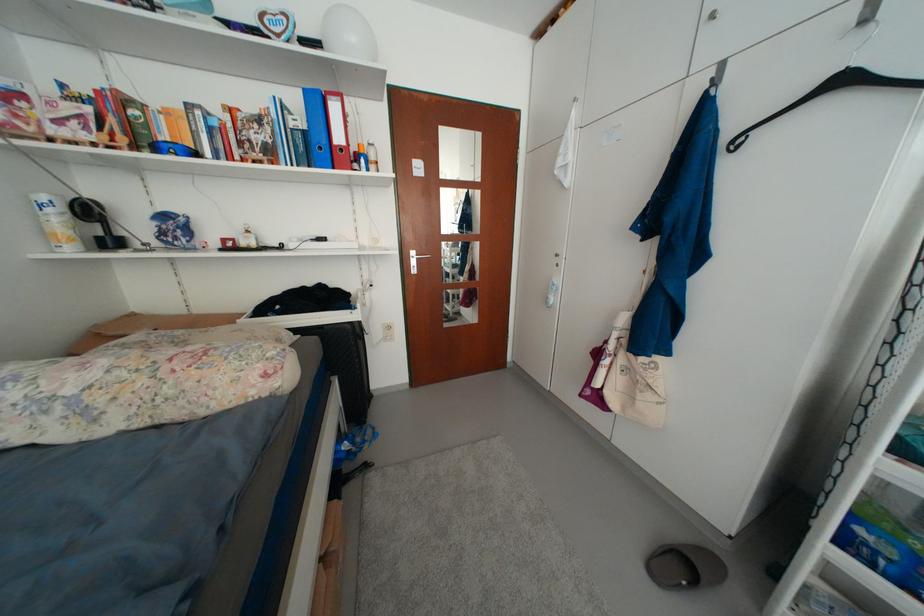
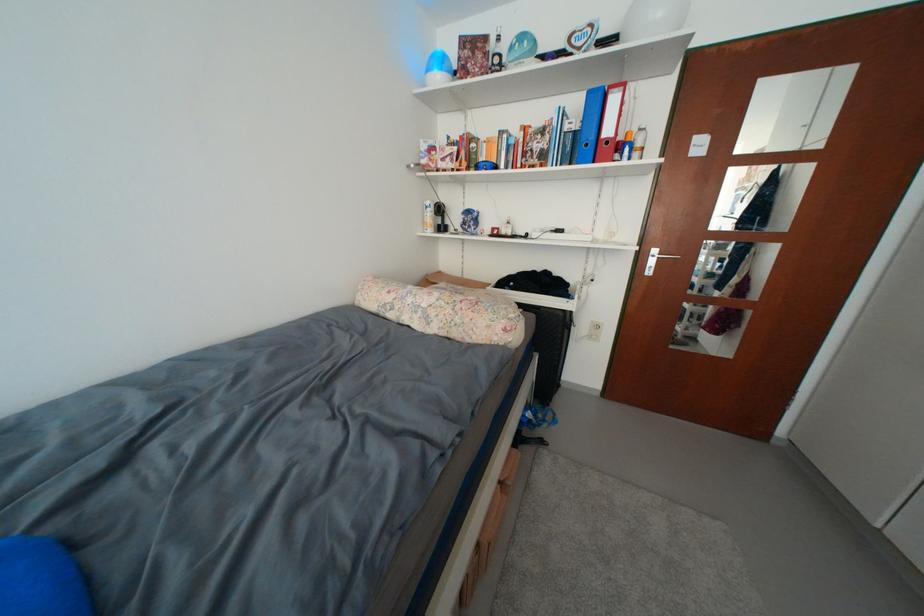
Locate, in the second image, the point that corresponds to pixel 274 378 in the first image.

(514, 331)